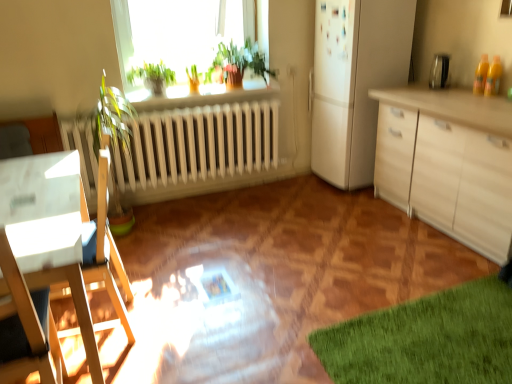
Question: Is green leafy plant at upper center, which is the second plant in left-to-right order, in front of or behind white wood desk at left in the image?

Choices:
 (A) front
 (B) behind

Answer: (B)

Question: Is green leafy plant at upper center, which is the first plant from right to left, taller or shorter than white wood desk at left?

Choices:
 (A) tall
 (B) short

Answer: (B)

Question: Which object is the closest to the white wood desk at left?

Choices:
 (A) green leafy plant at upper center
 (B) green leafy plant at upper center, which is the first plant from right to left
 (C) white matte refrigerator at upper right
 (D) green matte plant at upper center, which is the second plant in right-to-left order

Answer: (D)

Question: Which of these objects is positioned farthest from the white wood desk at left?

Choices:
 (A) green leafy plant at upper center, which is the first plant from right to left
 (B) green leafy plant at upper center
 (C) green matte plant at upper center, the first plant when ordered from left to right
 (D) white matte refrigerator at upper right

Answer: (D)